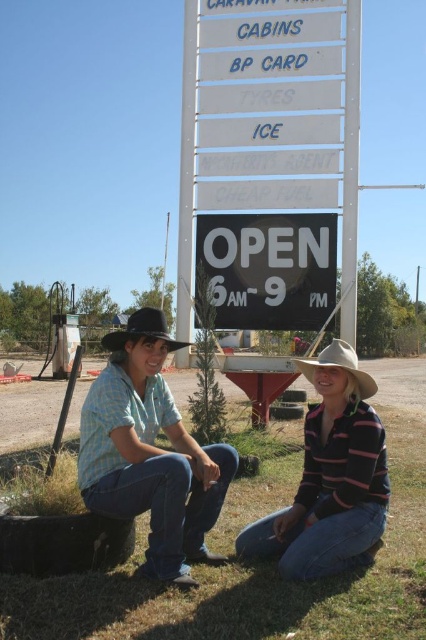
Who is positioned more to the left, green grass at lower center or blue plaid shirt at center?

Positioned to the left is blue plaid shirt at center.

Can you confirm if green grass at lower center is positioned above blue plaid shirt at center?

Actually, green grass at lower center is below blue plaid shirt at center.

Is point (250, 602) positioned after point (154, 412)?

No, (250, 602) is in front of (154, 412).

Where is `green grass at lower center`? Image resolution: width=426 pixels, height=640 pixels. green grass at lower center is located at coordinates (250, 584).

Does blue plaid shirt at center have a greater width compared to black plastic sign at center?

No.

Which of these two, blue plaid shirt at center or black plastic sign at center, stands shorter?

With less height is black plastic sign at center.

Who is more forward, (132, 374) or (258, 301)?

Point (132, 374) is in front.

The height and width of the screenshot is (640, 426). In order to click on blue plaid shirt at center in this screenshot , I will do `click(149, 452)`.

Which is above, white plastic signboard at center or striped cotton shirt at lower right?

white plastic signboard at center is above.

Does white plastic signboard at center appear on the left side of striped cotton shirt at lower right?

Indeed, white plastic signboard at center is positioned on the left side of striped cotton shirt at lower right.

Does point (331, 195) come farther from viewer compared to point (316, 525)?

That is True.

At what (x,y) coordinates should I click in order to perform the action: click on white plastic signboard at center. Please return your answer as a coordinate pair (x, y). Image resolution: width=426 pixels, height=640 pixels. Looking at the image, I should click on pos(270,122).